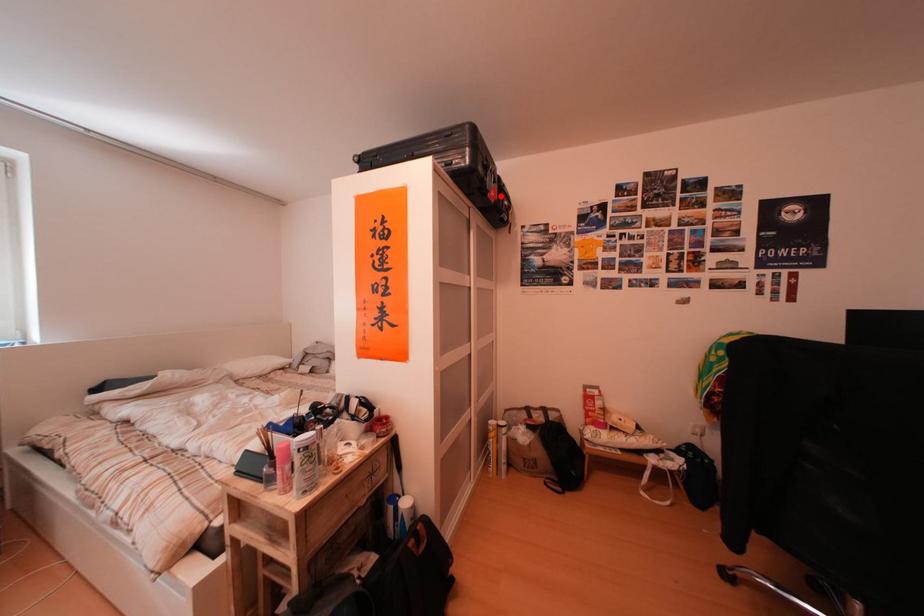
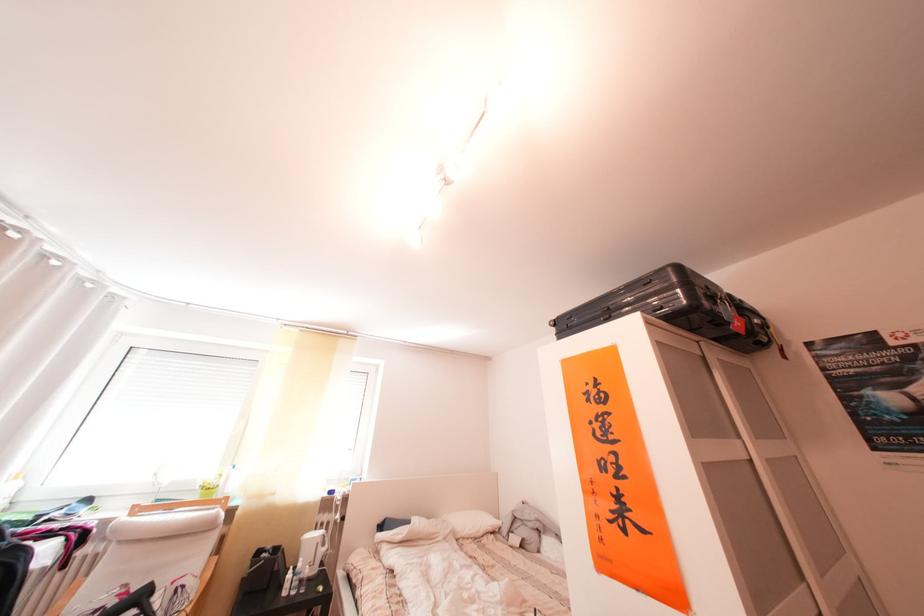
In the second image, find the point that corresponds to the highlighted location in the first image.

(742, 329)